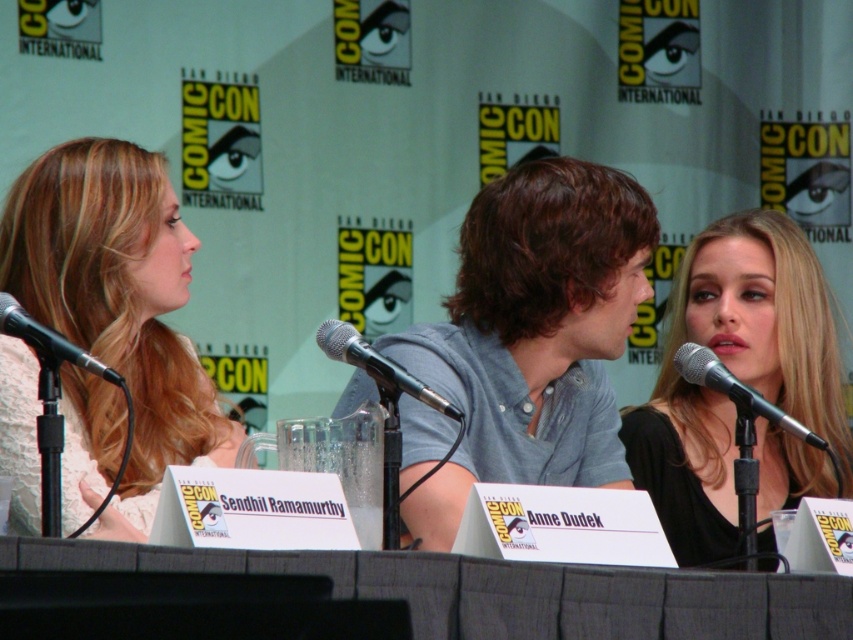
In the scene shown: You are attending a panel at ComicCon and want to sit at the table located at point (x=503, y=592). Is there space available for you to sit there?

The textured gray table at center is located at point (x=503, y=592), but the description does not provide information about available seating space. Please check the scene description for more details.